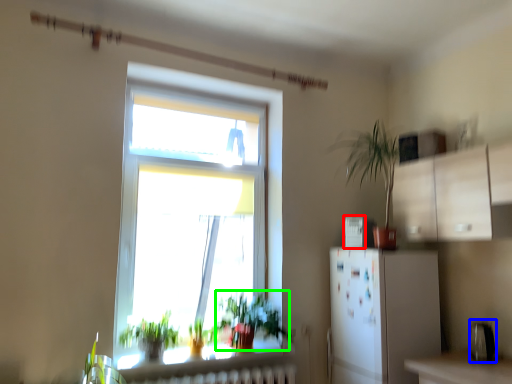
Question: Considering the real-world distances, which object is closest to appliance (highlighted by a red box)? appliance (highlighted by a blue box) or vegetation (highlighted by a green box).

Choices:
 (A) appliance
 (B) vegetation

Answer: (B)